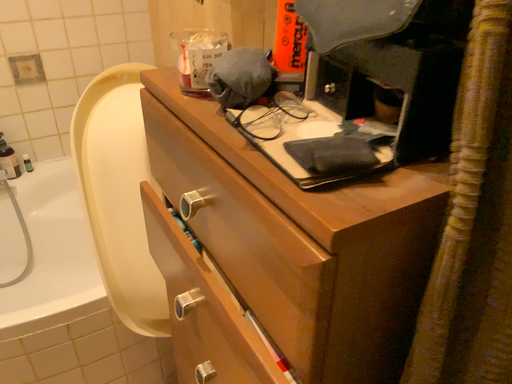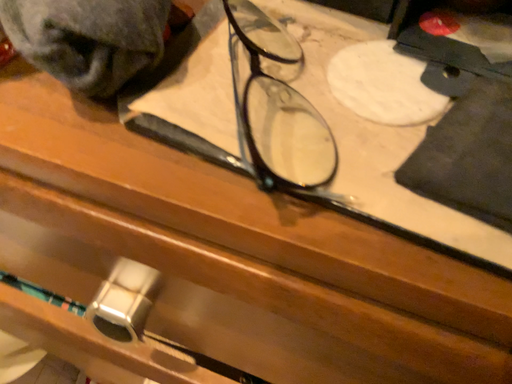
Question: Which way did the camera rotate in the video?

Choices:
 (A) rotated right
 (B) rotated left

Answer: (A)